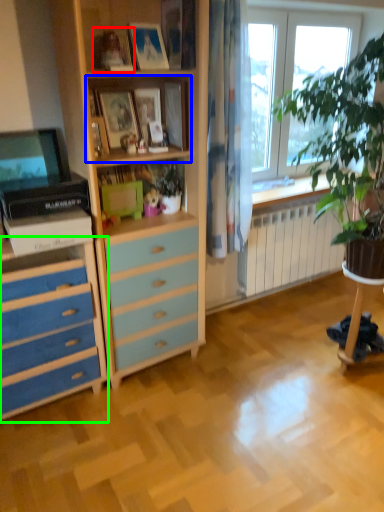
Question: Which object is the farthest from picture frame (highlighted by a red box)? Choose among these: shelf (highlighted by a blue box) or chest of drawers (highlighted by a green box).

Choices:
 (A) shelf
 (B) chest of drawers

Answer: (B)